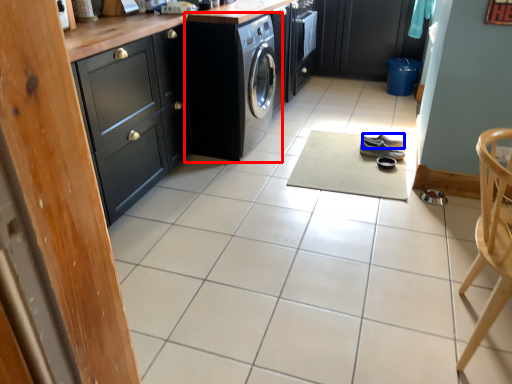
Question: Among these objects, which one is farthest to the camera, washing machine (highlighted by a red box) or footwear (highlighted by a blue box)?

Choices:
 (A) washing machine
 (B) footwear

Answer: (B)